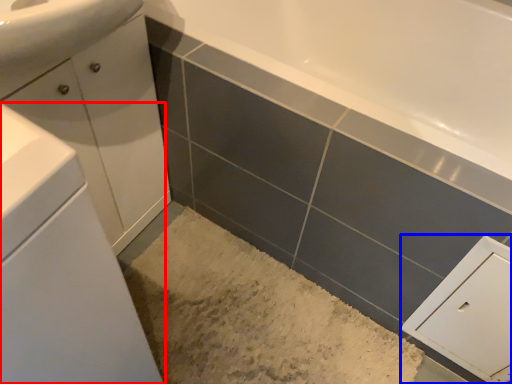
Question: Which of the following is the closest to the observer, bathroom cabinet (highlighted by a red box) or cabinetry (highlighted by a blue box)?

Choices:
 (A) bathroom cabinet
 (B) cabinetry

Answer: (A)